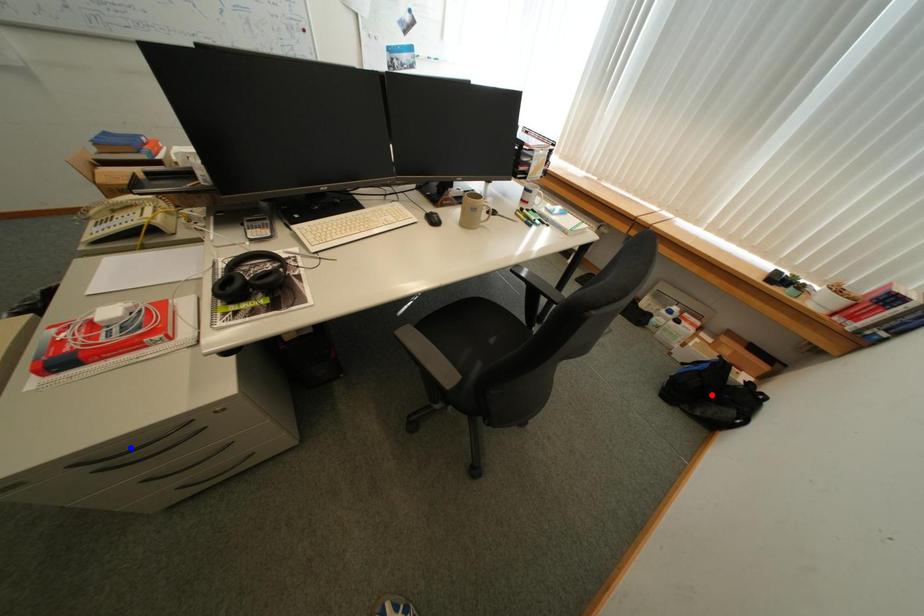
Question: In the image, two points are highlighted. Which point is nearer to the camera? Reply with the corresponding letter.

Choices:
 (A) blue point
 (B) red point

Answer: (A)